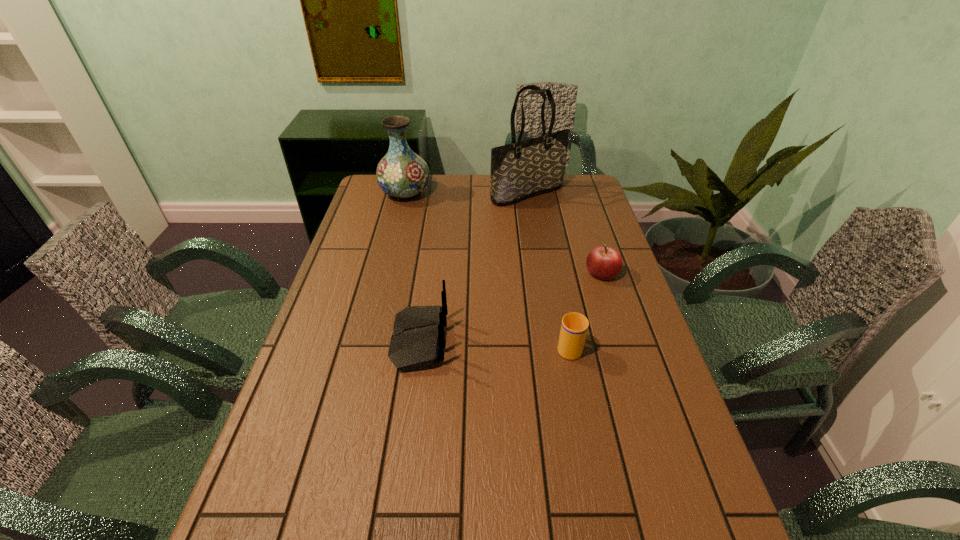
This screenshot has width=960, height=540. Identify the location of vacant space located 0.340m on the side of the cup with the handle. (551, 256).

Find the location of a particular element. Image resolution: width=960 pixels, height=540 pixels. vacant space located 0.250m on the front of the third farthest object is located at coordinates (625, 348).

You are a GUI agent. You are given a task and a screenshot of the screen. Output one action in this format:
    pyautogui.click(x=<x>, y=<y>)
    Task: Click on the tote bag at the far edge
    Image resolution: width=960 pixels, height=540 pixels.
    Given the screenshot: What is the action you would take?
    pyautogui.click(x=522, y=169)

The image size is (960, 540). I want to click on vase located in the far edge section of the desktop, so click(x=401, y=173).

At what (x,y) coordinates should I click in order to perform the action: click on object at the left edge. Please return your answer as a coordinate pair (x, y). The width and height of the screenshot is (960, 540). Looking at the image, I should click on (401, 173).

At what (x,y) coordinates should I click in order to perform the action: click on tote bag positioned at the right edge. Please return your answer as a coordinate pair (x, y). Looking at the image, I should click on (522, 169).

You are a GUI agent. You are given a task and a screenshot of the screen. Output one action in this format:
    pyautogui.click(x=<x>, y=<y>)
    Task: Click on the apple at the right edge
    This screenshot has height=540, width=960.
    Given the screenshot: What is the action you would take?
    pyautogui.click(x=604, y=263)

The height and width of the screenshot is (540, 960). Find the location of `object that is positioned at the far left corner`. object that is positioned at the far left corner is located at coordinates point(401,173).

Where is `object located at the far right corner`? The image size is (960, 540). object located at the far right corner is located at coordinates (522, 169).

What are the coordinates of `vacant area at the far edge` in the screenshot? It's located at (545, 193).